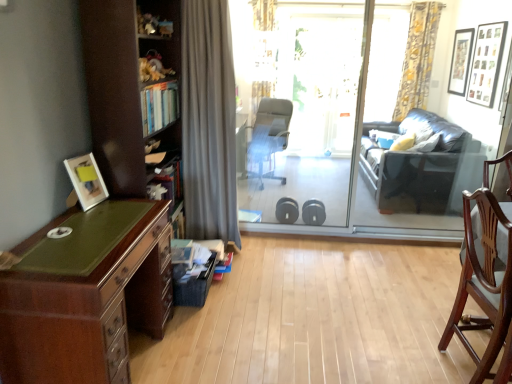
Question: From the image's perspective, is transparent glass door at center on transparent glass screen door at center?

Choices:
 (A) no
 (B) yes

Answer: (A)

Question: Is transparent glass door at center aimed at transparent glass screen door at center?

Choices:
 (A) yes
 (B) no

Answer: (A)

Question: Is transparent glass door at center to the left of transparent glass screen door at center from the viewer's perspective?

Choices:
 (A) yes
 (B) no

Answer: (B)

Question: Does transparent glass door at center have a greater width compared to transparent glass screen door at center?

Choices:
 (A) yes
 (B) no

Answer: (A)

Question: Is transparent glass door at center to the right of transparent glass screen door at center from the viewer's perspective?

Choices:
 (A) no
 (B) yes

Answer: (B)

Question: From the image's perspective, does transparent glass door at center appear lower than transparent glass screen door at center?

Choices:
 (A) yes
 (B) no

Answer: (A)

Question: From a real-world perspective, is gray fabric office chair at center, marked as the first chair in a top-to-bottom arrangement, located higher than transparent glass door at center?

Choices:
 (A) no
 (B) yes

Answer: (A)

Question: Is gray fabric office chair at center, arranged as the second chair when viewed from the right, outside of transparent glass door at center?

Choices:
 (A) yes
 (B) no

Answer: (A)

Question: Does gray fabric office chair at center, arranged as the second chair when viewed from the right, come in front of transparent glass door at center?

Choices:
 (A) no
 (B) yes

Answer: (A)

Question: Considering the relative sizes of gray fabric office chair at center, which is counted as the second chair, starting from the bottom, and transparent glass door at center in the image provided, is gray fabric office chair at center, which is counted as the second chair, starting from the bottom, smaller than transparent glass door at center?

Choices:
 (A) no
 (B) yes

Answer: (B)

Question: Does gray fabric office chair at center, arranged as the second chair when viewed from the right, have a greater width compared to transparent glass door at center?

Choices:
 (A) yes
 (B) no

Answer: (A)

Question: Does gray fabric office chair at center, which ranks as the first chair in back-to-front order, appear on the left side of transparent glass door at center?

Choices:
 (A) yes
 (B) no

Answer: (A)

Question: Considering the relative sizes of gray fabric office chair at center, which ranks as the first chair in back-to-front order, and black matte picture frame at upper right, the third picture frame from the bottom, in the image provided, is gray fabric office chair at center, which ranks as the first chair in back-to-front order, taller than black matte picture frame at upper right, the third picture frame from the bottom,?

Choices:
 (A) no
 (B) yes

Answer: (B)